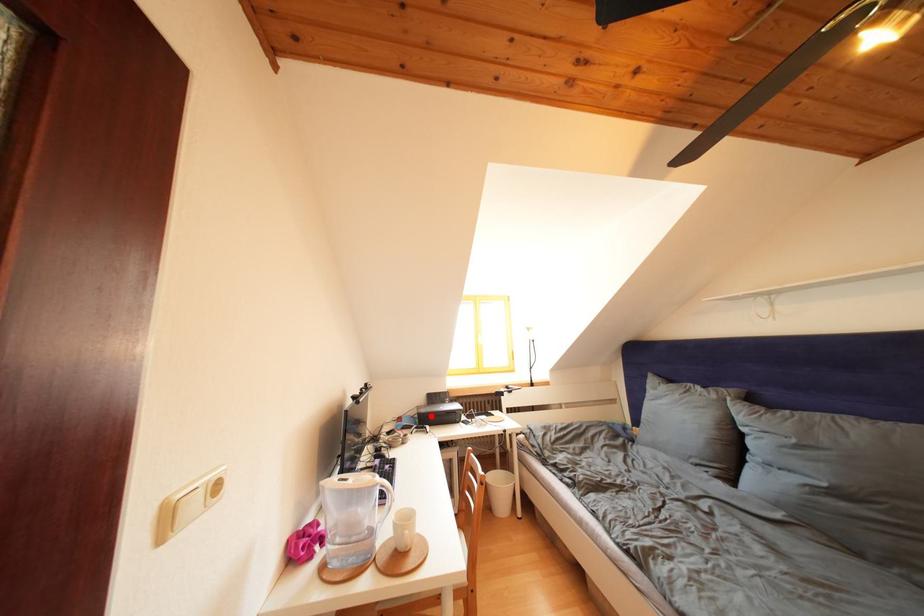
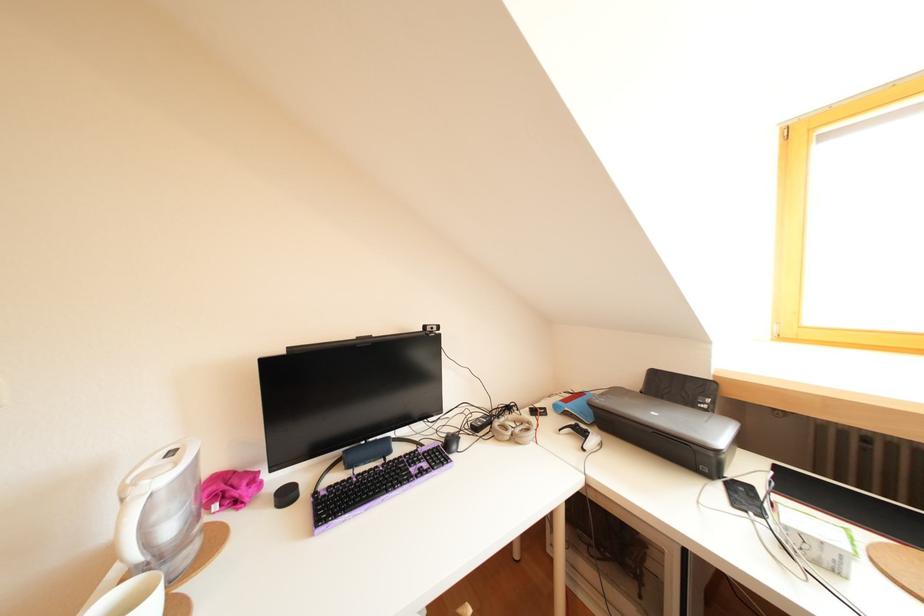
Question: I am providing you with two images of the same scene from different viewpoints. A red point is shown in image1. For the corresponding object point in image2, is it positioned nearer or farther from the camera?

Choices:
 (A) Nearer
 (B) Farther

Answer: (A)